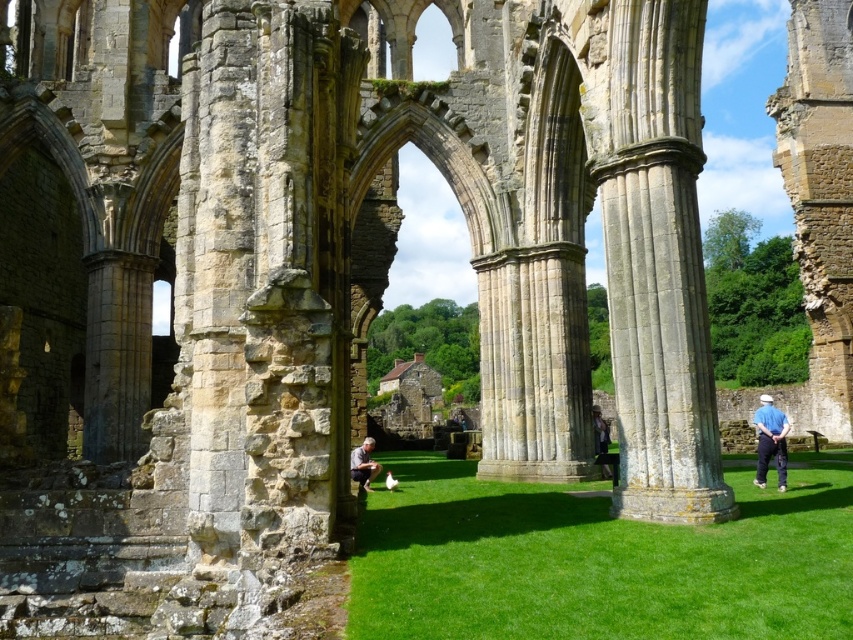
Is blue fabric pants at lower right bigger than matte gray shirt at center?

Correct, blue fabric pants at lower right is larger in size than matte gray shirt at center.

Is blue fabric pants at lower right to the right of matte gray shirt at center from the viewer's perspective?

Correct, you'll find blue fabric pants at lower right to the right of matte gray shirt at center.

Between point (759, 410) and point (366, 444), which one is positioned in front?

Positioned in front is point (366, 444).

The height and width of the screenshot is (640, 853). Find the location of `blue fabric pants at lower right`. blue fabric pants at lower right is located at coordinates (770, 442).

Is blue fabric pants at lower right bigger than dark blue jeans at center?

Correct, blue fabric pants at lower right is larger in size than dark blue jeans at center.

Is point (758, 483) closer to camera compared to point (602, 452)?

Yes, point (758, 483) is closer to viewer.

Locate an element on the screen. This screenshot has width=853, height=640. blue fabric pants at lower right is located at coordinates (770, 442).

Is green grass at center below matte gray shirt at center?

Yes, green grass at center is below matte gray shirt at center.

Is green grass at center bigger than matte gray shirt at center?

Correct, green grass at center is larger in size than matte gray shirt at center.

Is point (474, 492) positioned behind point (358, 461)?

No, (474, 492) is closer to viewer.

You are a GUI agent. You are given a task and a screenshot of the screen. Output one action in this format:
    pyautogui.click(x=<x>, y=<y>)
    Task: Click on the green grass at center
    
    Given the screenshot: What is the action you would take?
    coord(598,560)